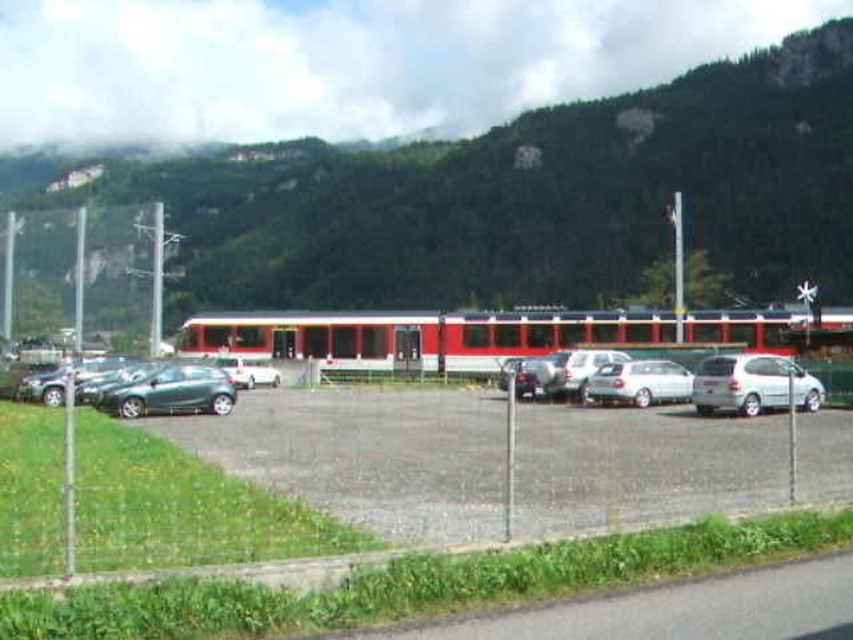
Question: Which point is closer to the camera?

Choices:
 (A) green forested mountain at upper center
 (B) metallic gray hatchback at lower left

Answer: (B)

Question: Does silver metallic minivan at right have a smaller size compared to white matte car at center?

Choices:
 (A) yes
 (B) no

Answer: (B)

Question: Is silver metallic hatchback at center bigger than white matte car at center?

Choices:
 (A) no
 (B) yes

Answer: (B)

Question: Is red matte train at center smaller than metallic gray hatchback at lower left?

Choices:
 (A) no
 (B) yes

Answer: (A)

Question: Which is farther from the green forested mountain at upper center?

Choices:
 (A) metallic silver sedan at center
 (B) silver metallic hatchback at center

Answer: (A)

Question: Estimate the real-world distances between objects in this image. Which object is closer to the green forested mountain at upper center?

Choices:
 (A) white matte car at center
 (B) silver metallic minivan at right

Answer: (B)